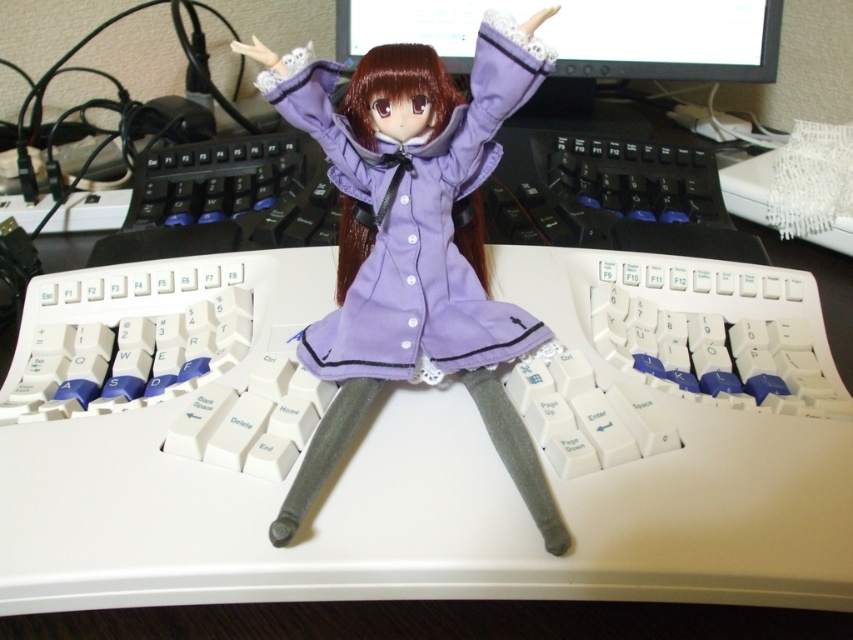
Is point (354, 337) less distant than point (563, 35)?

Yes, it is in front of point (563, 35).

Find the location of a particular element. Image resolution: width=853 pixels, height=640 pixels. purple fabric doll at center is located at coordinates (413, 244).